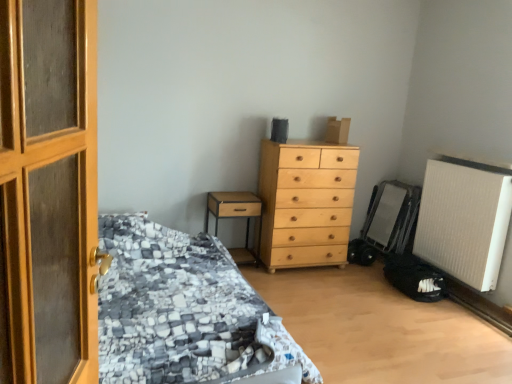
Question: Is light wood chest of drawers at center surrounding textured gray fabric bed at left?

Choices:
 (A) no
 (B) yes

Answer: (A)

Question: Is light wood chest of drawers at center beside textured gray fabric bed at left?

Choices:
 (A) no
 (B) yes

Answer: (A)

Question: From the image's perspective, would you say light wood chest of drawers at center is positioned over textured gray fabric bed at left?

Choices:
 (A) yes
 (B) no

Answer: (A)

Question: From a real-world perspective, is light wood chest of drawers at center under textured gray fabric bed at left?

Choices:
 (A) yes
 (B) no

Answer: (B)

Question: Can you confirm if light wood chest of drawers at center is bigger than textured gray fabric bed at left?

Choices:
 (A) no
 (B) yes

Answer: (A)

Question: Is light wood chest of drawers at center aimed at textured gray fabric bed at left?

Choices:
 (A) no
 (B) yes

Answer: (A)

Question: From the image's perspective, would you say white textured radiator at lower right is positioned over textured gray fabric bed at left?

Choices:
 (A) yes
 (B) no

Answer: (A)

Question: Is white textured radiator at lower right positioned with its back to textured gray fabric bed at left?

Choices:
 (A) yes
 (B) no

Answer: (B)

Question: Could you tell me if white textured radiator at lower right is turned towards textured gray fabric bed at left?

Choices:
 (A) yes
 (B) no

Answer: (A)

Question: From a real-world perspective, is white textured radiator at lower right below textured gray fabric bed at left?

Choices:
 (A) yes
 (B) no

Answer: (B)

Question: Is white textured radiator at lower right not within textured gray fabric bed at left?

Choices:
 (A) no
 (B) yes

Answer: (B)

Question: From a real-world perspective, is white textured radiator at lower right on top of textured gray fabric bed at left?

Choices:
 (A) yes
 (B) no

Answer: (A)

Question: Is light wood chest of drawers at center positioned with its back to white textured radiator at lower right?

Choices:
 (A) no
 (B) yes

Answer: (A)